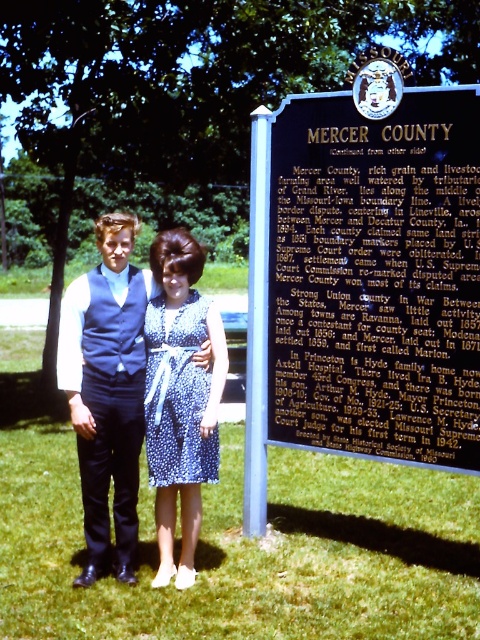
Based on the photo, you are a photographer planning to take a photo of the matte blue dress at center and the black metal sign at upper center. To ensure both are in focus, you need to know which object is taller. Can you tell me which one is taller?

The black metal sign at upper center has a greater height compared to the matte blue dress at center, so the black metal sign at upper center is taller.

You are standing in front of the historical marker for Mercer County, Missouri. There is a point marked at coordinates (375, 278). Where exactly is this point located on the marker?

The point at (375, 278) is on the black metal sign at upper center.

You are standing at the historical marker for Mercer County, Missouri, and want to take a photo of the point at coordinates point (x=444, y=113). If your camera has a focal length of 50mm and you are currently 15.90 feet away from the point, will you need to move closer or farther away to ensure the point fills the frame properly?

The distance of point (x=444, y=113) from camera is 15.90 feet. To fill the frame properly, you need to consider the camera specifications. However, since the given distance matches the current position, no adjustment is needed. The point is already at the correct distance of 15.90 feet.